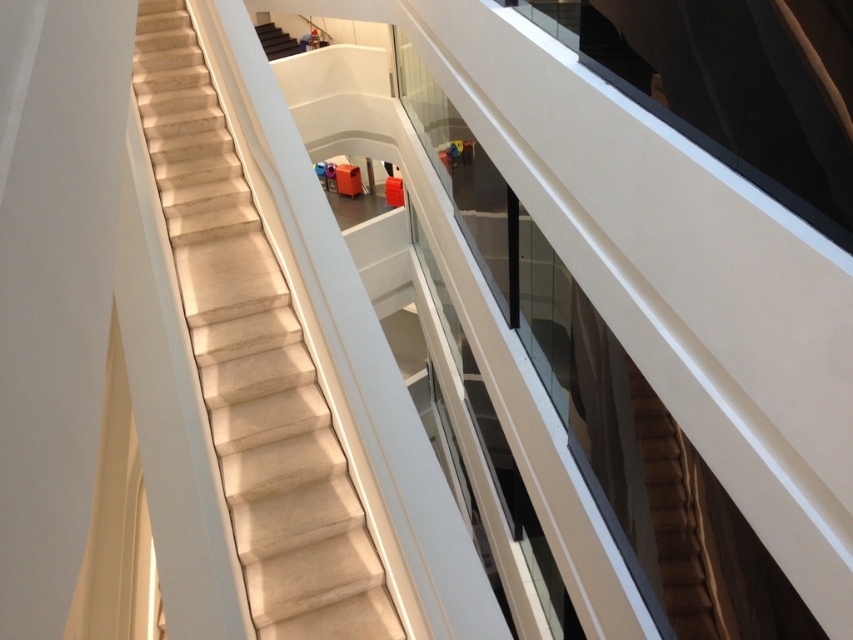
Between white marble stairs at center and smooth beige stairs at upper center, which one is positioned higher?

Positioned higher is smooth beige stairs at upper center.

Does point (230, 240) lie in front of point (280, 33)?

Yes, it is in front of point (280, 33).

This screenshot has height=640, width=853. What are the coordinates of `white marble stairs at center` in the screenshot? It's located at (253, 364).